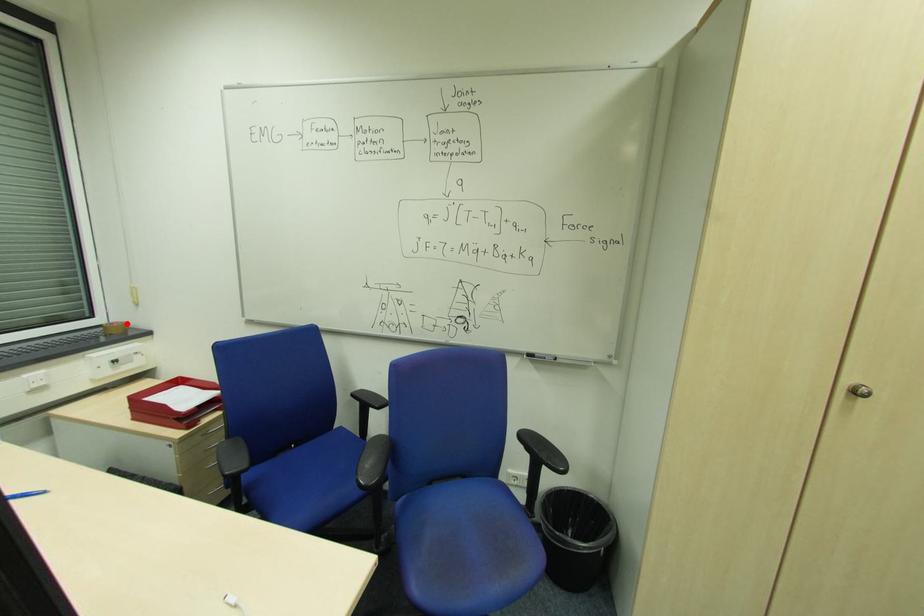
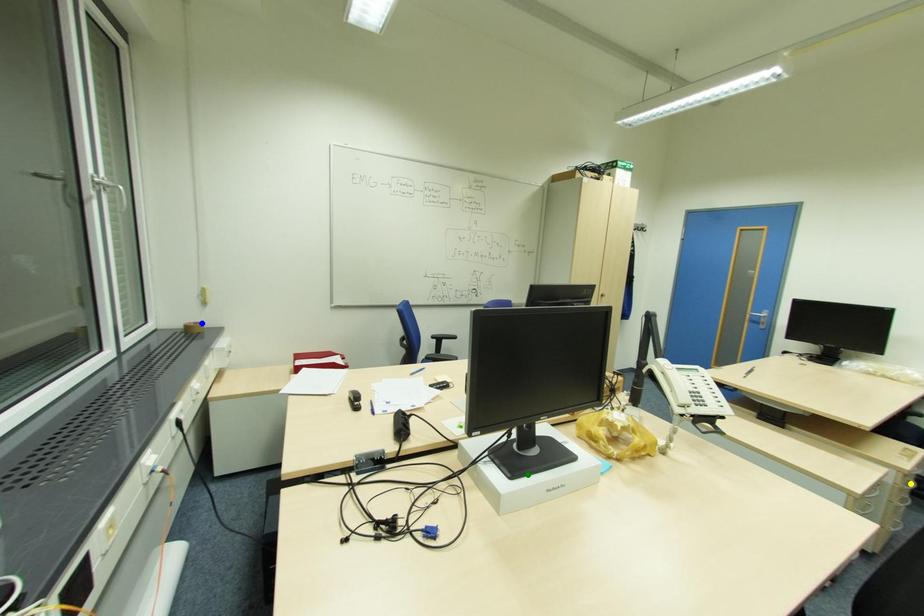
Question: I am providing you with two images of the same scene from different viewpoints. A red point is marked on the first image. You are given multiple points on the second image. In image 2, which mark is for the same physical point as the one in image 1?

Choices:
 (A) green point
 (B) blue point
 (C) yellow point

Answer: (B)